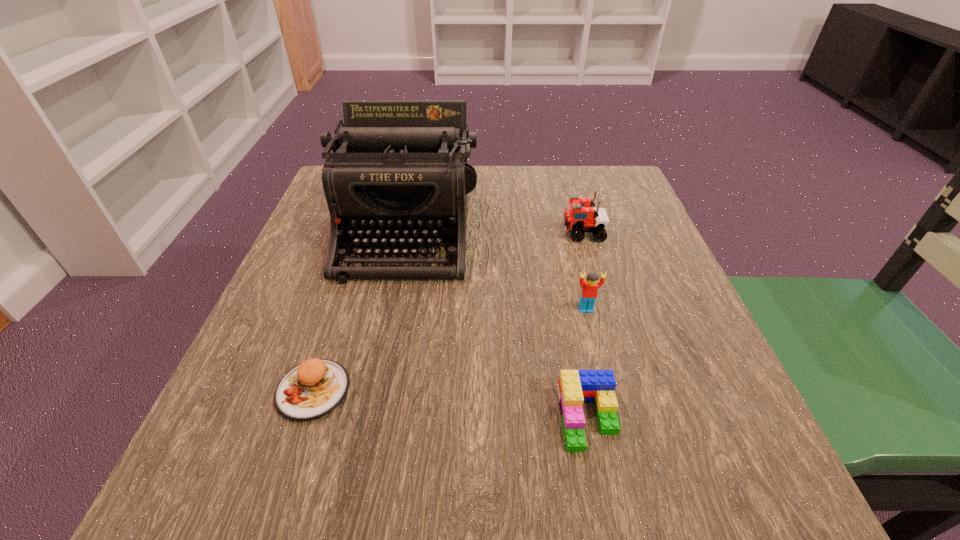
Where is `empty location between the farthest Lego and the third nearest object`? The height and width of the screenshot is (540, 960). empty location between the farthest Lego and the third nearest object is located at coordinates (584, 271).

Locate an element on the screen. empty location between the patty and the nearest Lego is located at coordinates (450, 404).

The image size is (960, 540). I want to click on vacant point located between the third farthest object and the patty, so click(449, 350).

Find the location of `object that ranks as the closest to the third nearest object`. object that ranks as the closest to the third nearest object is located at coordinates (575, 387).

Select which object appears as the closest to the patty. Please provide its 2D coordinates. Your answer should be formatted as a tuple, i.e. [(x, y)], where the tuple contains the x and y coordinates of a point satisfying the conditions above.

[(399, 173)]

Identify which Lego is the third closest to the patty. Please provide its 2D coordinates. Your answer should be formatted as a tuple, i.e. [(x, y)], where the tuple contains the x and y coordinates of a point satisfying the conditions above.

[(581, 216)]

The width and height of the screenshot is (960, 540). I want to click on Lego identified as the closest to the farthest Lego, so click(x=589, y=291).

Image resolution: width=960 pixels, height=540 pixels. I want to click on vacant space that satisfies the following two spatial constraints: 1. on the front-facing side of the farthest Lego; 2. on the front side of the patty, so click(x=628, y=390).

The width and height of the screenshot is (960, 540). In order to click on blank area in the image that satisfies the following two spatial constraints: 1. on the keyboard of the nearest Lego; 2. on the left side of the typewriter in this screenshot , I will do `click(366, 418)`.